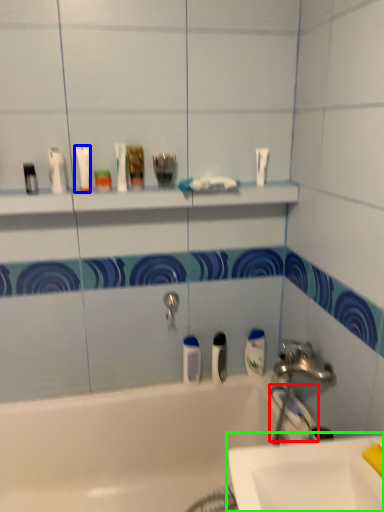
Question: Which object is positioned farthest from toothbrush (highlighted by a red box)? Select from mouthwash (highlighted by a blue box) and sink (highlighted by a green box).

Choices:
 (A) mouthwash
 (B) sink

Answer: (A)